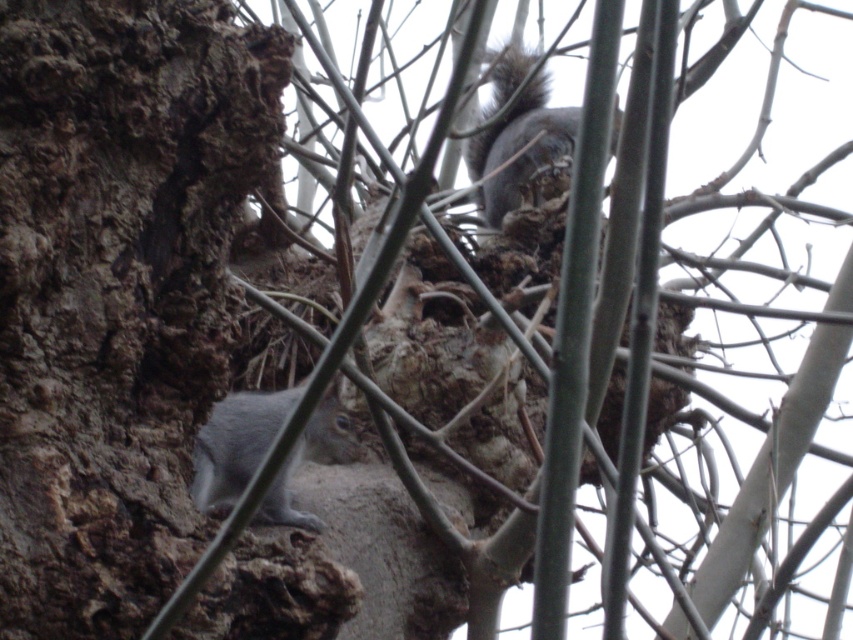
You are a photographer trying to capture both squirrels in a single shot. You notice two points of interest marked as point (511, 188) and point (202, 476). Which point is closer to the camera?

Point (202, 476) is closer to the camera because the description states that point (511, 188) is behind point (202, 476).

From the picture: You are observing two gray squirrels in a tree. You notice the gray furry squirrel at lower left and the gray fur tail at lower left. Which one is taller?

The gray furry squirrel at lower left is taller than the gray fur tail at lower left.

You are observing two squirrels in a tree. The first squirrel is the gray fur squirrel at upper center marked by point (519, 148). The second squirrel is partially hidden by branches. Which squirrel is closer to the viewer?

The gray fur squirrel at upper center marked by point (519, 148) is closer to the viewer than the other squirrel, which is partially hidden by branches.